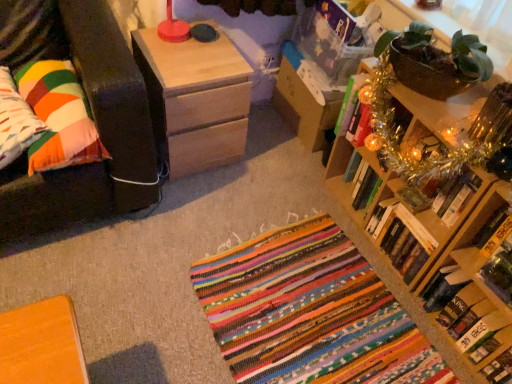
Identify the location of free space that is in between natural wood nightstand at upper left and hardcover book at center right, which is the third book in top-to-bottom order. (281, 200).